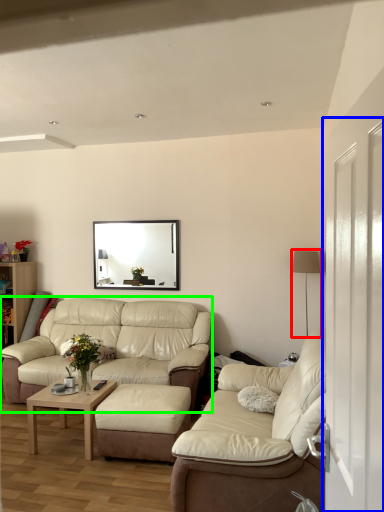
Question: Based on their relative distances, which object is farther from lamp (highlighted by a red box)? Choose from glass door (highlighted by a blue box) and studio couch (highlighted by a green box).

Choices:
 (A) glass door
 (B) studio couch

Answer: (A)